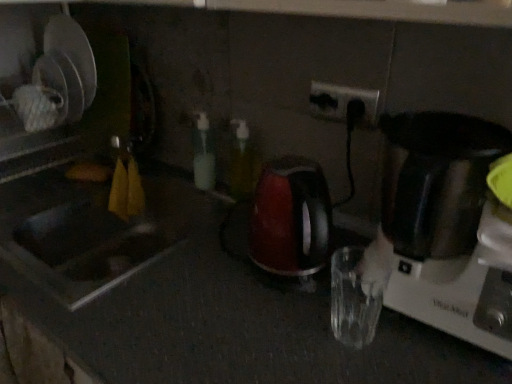
Describe the element at coordinates (203, 154) in the screenshot. I see `translucent plastic bottle at center, which is counted as the 2th bottle, starting from the right` at that location.

Where is `green translucent bottle at center, the 1th bottle positioned from the right`? green translucent bottle at center, the 1th bottle positioned from the right is located at coordinates (x=242, y=161).

Identify the location of matte stainless steel sink at left. Image resolution: width=512 pixels, height=384 pixels. (88, 231).

This screenshot has height=384, width=512. What are the coordinates of `white plastic electric outlet at upper center` in the screenshot? It's located at (342, 102).

Identify the location of the 2nd bottle behind the shiny black blender at right, counting from the anchor's position. The image size is (512, 384). (203, 154).

Is translucent plastic bottle at center, acting as the 1th bottle starting from the left, aimed at shiny black blender at right?

No, translucent plastic bottle at center, acting as the 1th bottle starting from the left, is not aimed at shiny black blender at right.

Is matte stainless steel sink at left wider than translucent plastic bottle at center, which is counted as the 2th bottle, starting from the right?

Indeed, matte stainless steel sink at left has a greater width compared to translucent plastic bottle at center, which is counted as the 2th bottle, starting from the right.

From a real-world perspective, is matte stainless steel sink at left above or below translucent plastic bottle at center, acting as the 1th bottle starting from the left?

From a real-world perspective, matte stainless steel sink at left is physically below translucent plastic bottle at center, acting as the 1th bottle starting from the left.

Is matte stainless steel sink at left at the left side of translucent plastic bottle at center, acting as the 1th bottle starting from the left?

Yes.

Is matte stainless steel sink at left to the left of shiny black blender at right from the viewer's perspective?

Indeed, matte stainless steel sink at left is positioned on the left side of shiny black blender at right.

Could you tell me if matte stainless steel sink at left is facing shiny black blender at right?

No, matte stainless steel sink at left is not oriented towards shiny black blender at right.

Where is `sink below the shiny black blender at right (from a real-world perspective)`? The image size is (512, 384). sink below the shiny black blender at right (from a real-world perspective) is located at coordinates (88, 231).

Is shiny black blender at right looking in the opposite direction of white plastic electric outlet at upper center?

No, shiny black blender at right is not facing the opposite direction of white plastic electric outlet at upper center.

Which is closer, (443,255) or (350,100)?

The point (443,255) is more forward.

From the image's perspective, is shiny black blender at right above or below white plastic electric outlet at upper center?

From the image's perspective, shiny black blender at right appears below white plastic electric outlet at upper center.

How distant is shiny black blender at right from white plastic electric outlet at upper center?

The distance of shiny black blender at right from white plastic electric outlet at upper center is 10.18 inches.

Considering the positions of objects translucent plastic bottle at center, which is counted as the 2th bottle, starting from the right, and green translucent bottle at center, the 1th bottle positioned from the right, in the image provided, who is in front, translucent plastic bottle at center, which is counted as the 2th bottle, starting from the right, or green translucent bottle at center, the 1th bottle positioned from the right,?

green translucent bottle at center, the 1th bottle positioned from the right.

Which of these two, translucent plastic bottle at center, which is counted as the 2th bottle, starting from the right, or green translucent bottle at center, the 1th bottle positioned from the right, stands shorter?

green translucent bottle at center, the 1th bottle positioned from the right.

Is translucent plastic bottle at center, which is counted as the 2th bottle, starting from the right, with green translucent bottle at center, the 1th bottle positioned from the right?

Absolutely, translucent plastic bottle at center, which is counted as the 2th bottle, starting from the right, is next to and touching green translucent bottle at center, the 1th bottle positioned from the right.

Which is in front, point (201, 161) or point (249, 191)?

Positioned in front is point (201, 161).

Is white plastic electric outlet at upper center facing towards translucent plastic bottle at center, acting as the 1th bottle starting from the left?

No, white plastic electric outlet at upper center does not turn towards translucent plastic bottle at center, acting as the 1th bottle starting from the left.

Which is in front, white plastic electric outlet at upper center or translucent plastic bottle at center, acting as the 1th bottle starting from the left?

Positioned in front is white plastic electric outlet at upper center.

Who is smaller, white plastic electric outlet at upper center or translucent plastic bottle at center, which is counted as the 2th bottle, starting from the right?

white plastic electric outlet at upper center is smaller.

Can you tell me how much matte stainless steel sink at left and green translucent bottle at center, the 1th bottle positioned from the right, differ in facing direction?

The angular difference between matte stainless steel sink at left and green translucent bottle at center, the 1th bottle positioned from the right, is 0.000619 degrees.

From a real-world perspective, who is located lower, matte stainless steel sink at left or green translucent bottle at center, the 1th bottle positioned from the right?

matte stainless steel sink at left, from a real-world perspective.

Looking at this image, is matte stainless steel sink at left taller than green translucent bottle at center, the 1th bottle positioned from the right?

Correct, matte stainless steel sink at left is much taller as green translucent bottle at center, the 1th bottle positioned from the right.

Which bottle is the 2nd one when counting from the back of the shiny black blender at right? Please provide its 2D coordinates.

[(203, 154)]

From a real-world perspective, count 1st bottles upward from the matte stainless steel sink at left and point to it. Please provide its 2D coordinates.

[(203, 154)]

When comparing their distances from translucent plastic bottle at center, acting as the 1th bottle starting from the left, does matte stainless steel sink at left or green translucent bottle at center, positioned as the 2th bottle in left-to-right order, seem closer?

green translucent bottle at center, positioned as the 2th bottle in left-to-right order, is positioned closer to the anchor translucent plastic bottle at center, acting as the 1th bottle starting from the left.

Which object lies nearer to the anchor point white plastic electric outlet at upper center, matte stainless steel sink at left or translucent plastic bottle at center, which is counted as the 2th bottle, starting from the right?

Based on the image, translucent plastic bottle at center, which is counted as the 2th bottle, starting from the right, appears to be nearer to white plastic electric outlet at upper center.

From the image, which object appears to be nearer to matte stainless steel sink at left, translucent plastic bottle at center, acting as the 1th bottle starting from the left, or shiny black blender at right?

translucent plastic bottle at center, acting as the 1th bottle starting from the left.

Looking at the image, which one is located closer to green translucent bottle at center, the 1th bottle positioned from the right, shiny black blender at right or matte stainless steel sink at left?

matte stainless steel sink at left lies closer to green translucent bottle at center, the 1th bottle positioned from the right, than the other object.

Considering their positions, is translucent plastic bottle at center, which is counted as the 2th bottle, starting from the right, positioned further to matte stainless steel sink at left than green translucent bottle at center, positioned as the 2th bottle in left-to-right order?

Among the two, green translucent bottle at center, positioned as the 2th bottle in left-to-right order, is located further to matte stainless steel sink at left.

When comparing their distances from green translucent bottle at center, the 1th bottle positioned from the right, does translucent plastic bottle at center, acting as the 1th bottle starting from the left, or shiny black blender at right seem further?

The object further to green translucent bottle at center, the 1th bottle positioned from the right, is shiny black blender at right.

Which object lies nearer to the anchor point translucent plastic bottle at center, acting as the 1th bottle starting from the left, white plastic electric outlet at upper center or shiny black blender at right?

Among the two, white plastic electric outlet at upper center is located nearer to translucent plastic bottle at center, acting as the 1th bottle starting from the left.

Which object lies nearer to the anchor point translucent plastic bottle at center, acting as the 1th bottle starting from the left, white plastic electric outlet at upper center or matte stainless steel sink at left?

matte stainless steel sink at left.

Identify the location of bottle positioned between matte stainless steel sink at left and translucent plastic bottle at center, acting as the 1th bottle starting from the left, from near to far. (242, 161).

Where is `bottle between translucent plastic bottle at center, acting as the 1th bottle starting from the left, and white plastic electric outlet at upper center, in the horizontal direction`? This screenshot has height=384, width=512. bottle between translucent plastic bottle at center, acting as the 1th bottle starting from the left, and white plastic electric outlet at upper center, in the horizontal direction is located at coordinates (242, 161).

The width and height of the screenshot is (512, 384). I want to click on electric outlet between matte stainless steel sink at left and shiny black blender at right, so click(x=342, y=102).

Identify the location of electric outlet positioned between shiny black blender at right and green translucent bottle at center, the 1th bottle positioned from the right, from near to far. The width and height of the screenshot is (512, 384). (342, 102).